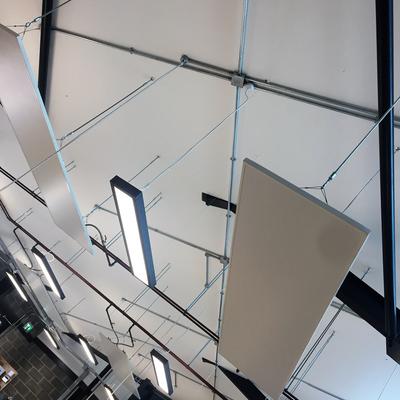
This screenshot has width=400, height=400. What are the coordinates of `lights that are not on` in the screenshot? It's located at (291, 278), (40, 148).